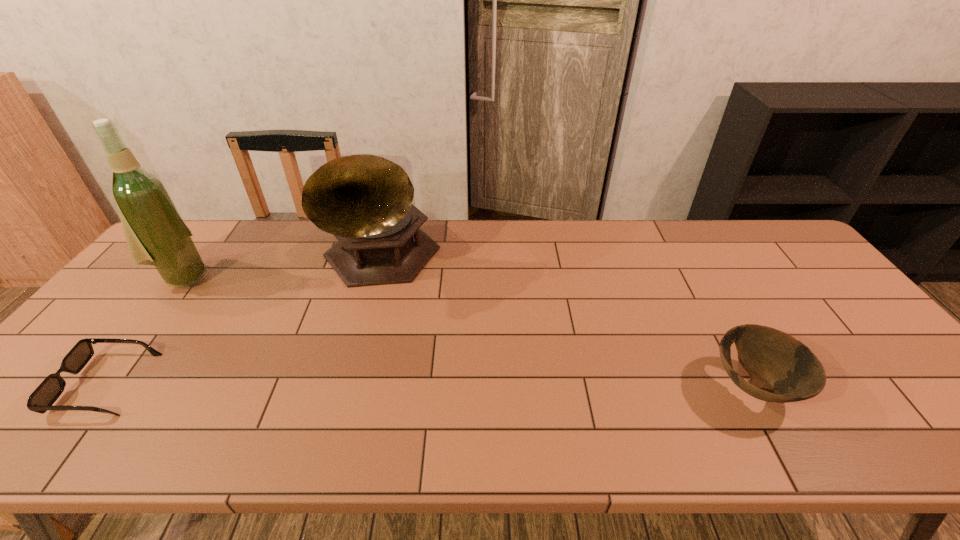
Identify the location of object present at the near left corner. This screenshot has width=960, height=540. (44, 396).

The width and height of the screenshot is (960, 540). What are the coordinates of `vacant space at the far edge of the desktop` in the screenshot? It's located at (445, 233).

In order to click on free region at the near edge in this screenshot , I will do `click(414, 400)`.

This screenshot has height=540, width=960. Identify the location of free space at the left edge. (120, 307).

Identify the location of free space at the right edge. This screenshot has height=540, width=960. (830, 355).

The width and height of the screenshot is (960, 540). What are the coordinates of `free location at the near left corner of the desktop` in the screenshot? It's located at (66, 410).

Locate an element on the screen. Image resolution: width=960 pixels, height=540 pixels. free space at the near right corner of the desktop is located at coordinates (886, 395).

Find the location of a particular element. free space between the shortest object and the second tallest object is located at coordinates (243, 323).

Where is `vacant point located between the sunglasses and the bowl`? The image size is (960, 540). vacant point located between the sunglasses and the bowl is located at coordinates (430, 386).

What are the coordinates of `blank region between the wine bottle and the sunglasses` in the screenshot? It's located at pyautogui.click(x=145, y=330).